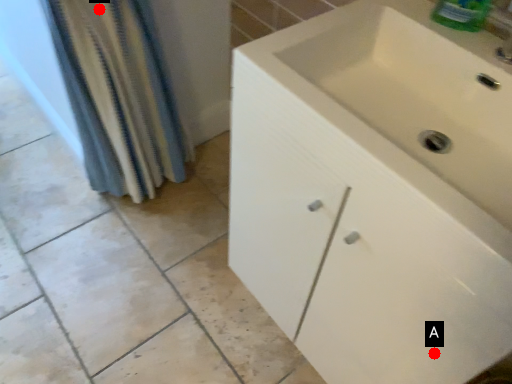
Question: Two points are circled on the image, labeled by A and B beside each circle. Which point appears farthest from the camera in this image?

Choices:
 (A) A is further
 (B) B is further

Answer: (B)